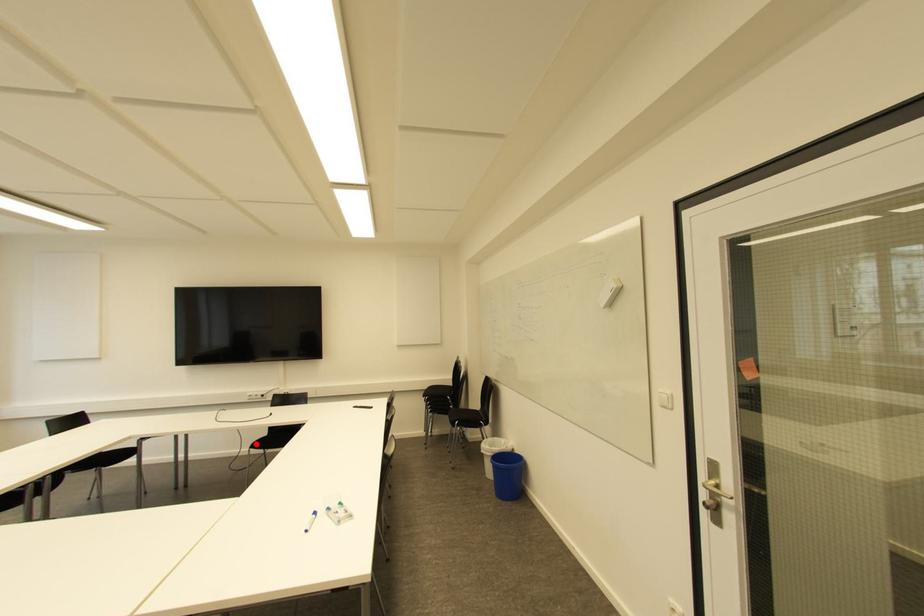
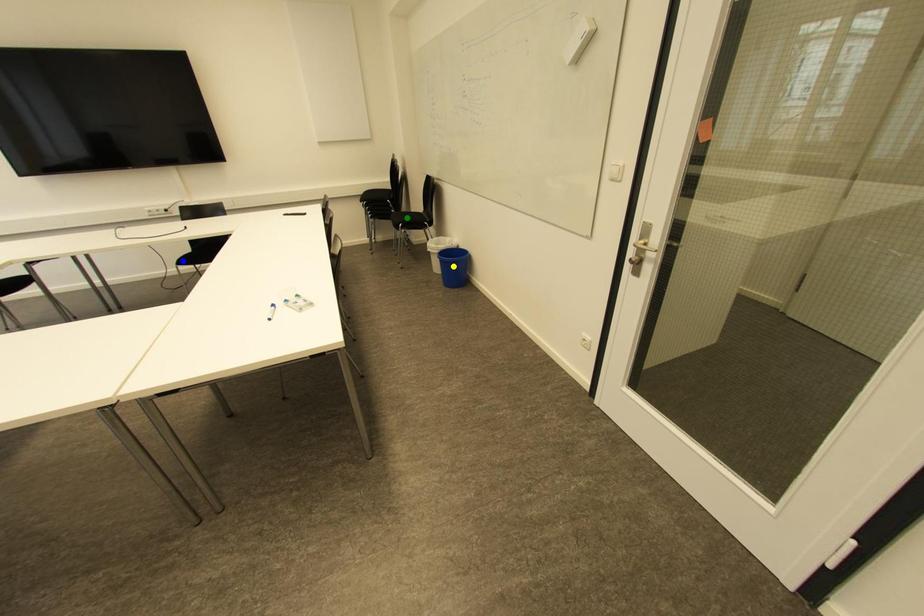
Question: I am providing you with two images of the same scene from different viewpoints. A red point is marked on the first image. You are given multiple points on the second image. Which spot in image 2 lines up with the point in image 1?

Choices:
 (A) yellow point
 (B) blue point
 (C) green point

Answer: (B)